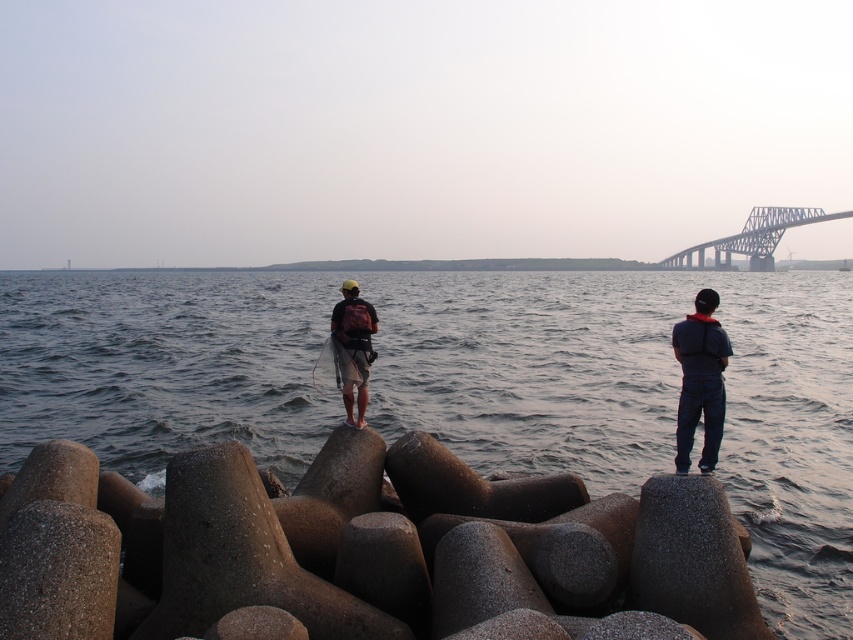
Between gray metallic bridge at upper right and matte black backpack at center, which one has less height?

With less height is matte black backpack at center.

Does gray metallic bridge at upper right have a smaller size compared to matte black backpack at center?

No.

Describe the element at coordinates (753, 237) in the screenshot. I see `gray metallic bridge at upper right` at that location.

Locate an element on the screen. The image size is (853, 640). gray metallic bridge at upper right is located at coordinates (753, 237).

Can you confirm if dark blue fabric jacket at right is bigger than gray metallic bridge at upper right?

Incorrect, dark blue fabric jacket at right is not larger than gray metallic bridge at upper right.

Is point (694, 388) behind point (701, 264)?

No, (694, 388) is in front of (701, 264).

Identify the location of dark blue fabric jacket at right. (700, 380).

Is point (194, 408) positioned before point (701, 342)?

No, (194, 408) is behind (701, 342).

How distant is gray concrete water at center from dark blue fabric jacket at right?

gray concrete water at center is 63.82 meters away from dark blue fabric jacket at right.

Does point (445, 435) come closer to viewer compared to point (689, 356)?

No, (445, 435) is further to viewer.

Where is `gray concrete water at center`? Image resolution: width=853 pixels, height=640 pixels. gray concrete water at center is located at coordinates (642, 397).